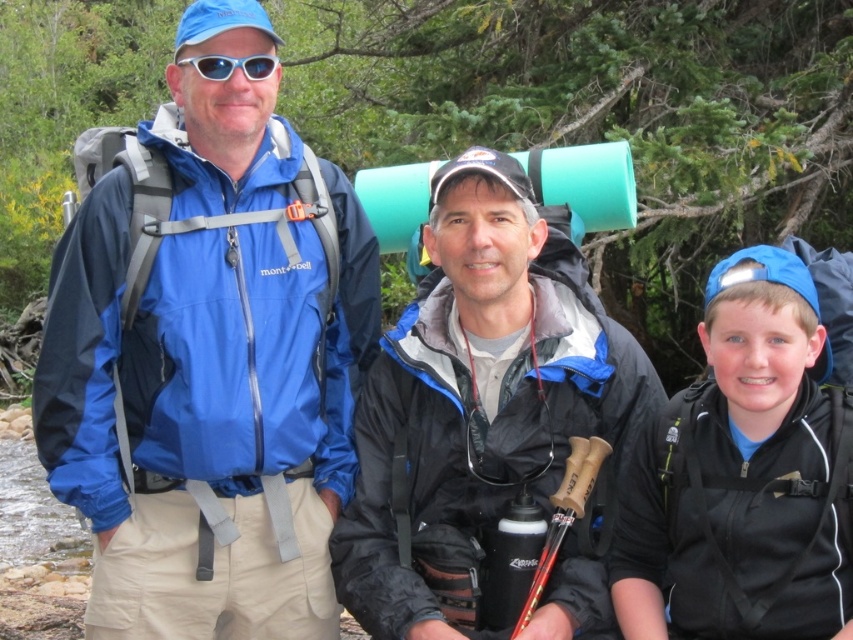
Does black matte jacket at right have a larger size compared to white plastic goggles at upper center?

Yes, black matte jacket at right is bigger than white plastic goggles at upper center.

Can you confirm if black matte jacket at right is shorter than white plastic goggles at upper center?

No, black matte jacket at right is not shorter than white plastic goggles at upper center.

Does point (643, 452) come behind point (276, 58)?

That is False.

The height and width of the screenshot is (640, 853). What are the coordinates of `black matte jacket at right` in the screenshot? It's located at (743, 476).

Does blue fabric jacket at center appear on the right side of white plastic goggles at upper center?

Incorrect, blue fabric jacket at center is not on the right side of white plastic goggles at upper center.

Is blue fabric jacket at center below white plastic goggles at upper center?

Yes, blue fabric jacket at center is below white plastic goggles at upper center.

This screenshot has width=853, height=640. In order to click on blue fabric jacket at center in this screenshot , I will do `click(207, 356)`.

Between point (543, 317) and point (219, 56), which one is positioned behind?

The point (543, 317) is more distant.

I want to click on matte black jacket at center, so click(x=477, y=401).

This screenshot has width=853, height=640. Identify the location of matte black jacket at center. [x=477, y=401].